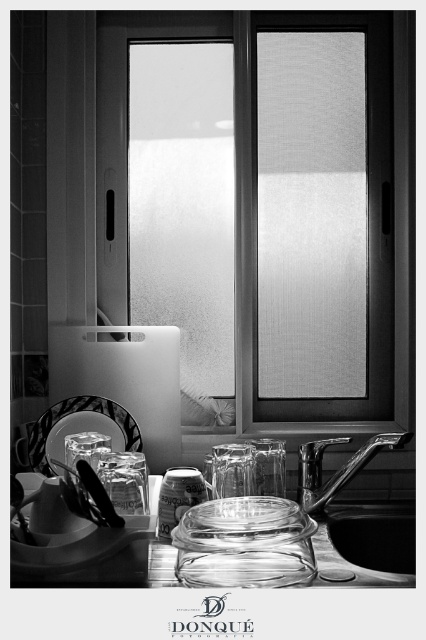
Question: Which object is positioned closest to the metallic sink at lower right?

Choices:
 (A) transparent glass jar at center
 (B) frosted glass window at center
 (C) clear glass platter at lower center

Answer: (B)

Question: Can you confirm if transparent glass jar at center is positioned below metallic sink at lower right?

Choices:
 (A) no
 (B) yes

Answer: (A)

Question: Can you confirm if frosted glass window at center is positioned below clear glass platter at lower center?

Choices:
 (A) no
 (B) yes

Answer: (A)

Question: Is frosted glass window at center bigger than clear glass platter at lower center?

Choices:
 (A) no
 (B) yes

Answer: (B)

Question: Which is farther from the transparent glass jar at center?

Choices:
 (A) clear glass platter at lower center
 (B) metallic sink at lower right

Answer: (B)

Question: Which object appears closest to the camera in this image?

Choices:
 (A) frosted glass window at center
 (B) clear glass platter at lower center

Answer: (B)